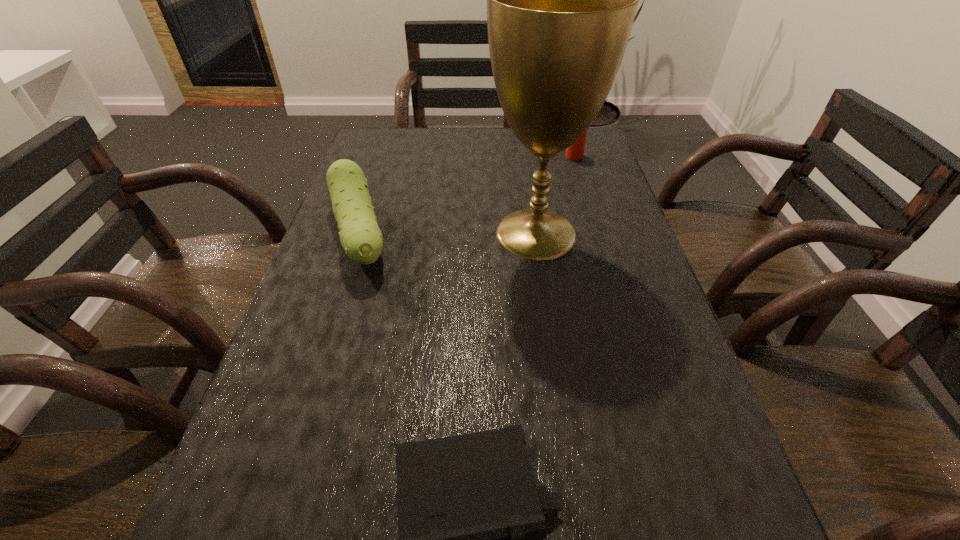
Locate an element on the screen. trophy cup is located at coordinates (561, 0).

The width and height of the screenshot is (960, 540). Find the location of `the second tallest object`. the second tallest object is located at coordinates (575, 152).

This screenshot has width=960, height=540. I want to click on the rightmost object, so click(x=575, y=152).

Where is `the second shortest object`? the second shortest object is located at coordinates (360, 236).

Locate an element on the screen. The image size is (960, 540). the leftmost object is located at coordinates [360, 236].

What are the coordinates of `vacant space situated 0.280m on the left of the tallest object` in the screenshot? It's located at (366, 234).

I want to click on vacant space located 0.340m on the left of the Tabasco sauce, so click(451, 156).

Locate an element on the screen. free spot located 0.170m on the right of the second shortest object is located at coordinates (467, 235).

Find the location of `object that is at the far edge`. object that is at the far edge is located at coordinates (575, 152).

This screenshot has height=540, width=960. I want to click on object that is at the left edge, so click(360, 236).